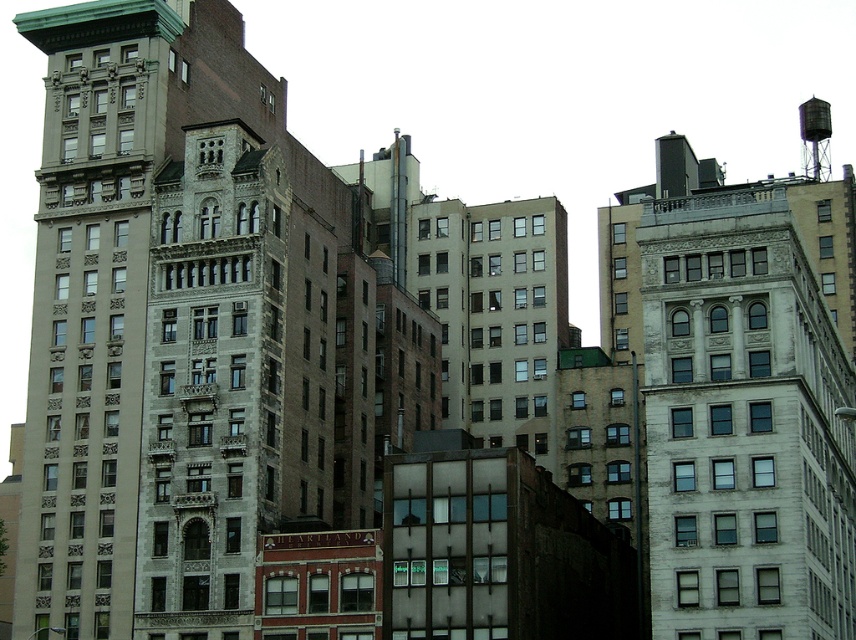
Question: Is gray stone building at center positioned at the back of metallic gray water tower at upper right?

Choices:
 (A) no
 (B) yes

Answer: (A)

Question: Does white stone building at upper right appear on the left side of metallic gray water tower at upper right?

Choices:
 (A) yes
 (B) no

Answer: (A)

Question: Which point is farther to the camera?

Choices:
 (A) (818, 390)
 (B) (22, 486)

Answer: (B)

Question: Which object is closer to the camera taking this photo?

Choices:
 (A) white stone building at upper right
 (B) gray stone building at center
 (C) metallic gray water tower at upper right

Answer: (A)

Question: Is beige stone building at left positioned at the back of metallic gray water tower at upper right?

Choices:
 (A) yes
 (B) no

Answer: (B)

Question: Which object is positioned closest to the beige stone building at left?

Choices:
 (A) metallic gray water tower at upper right
 (B) gray stone building at center

Answer: (B)